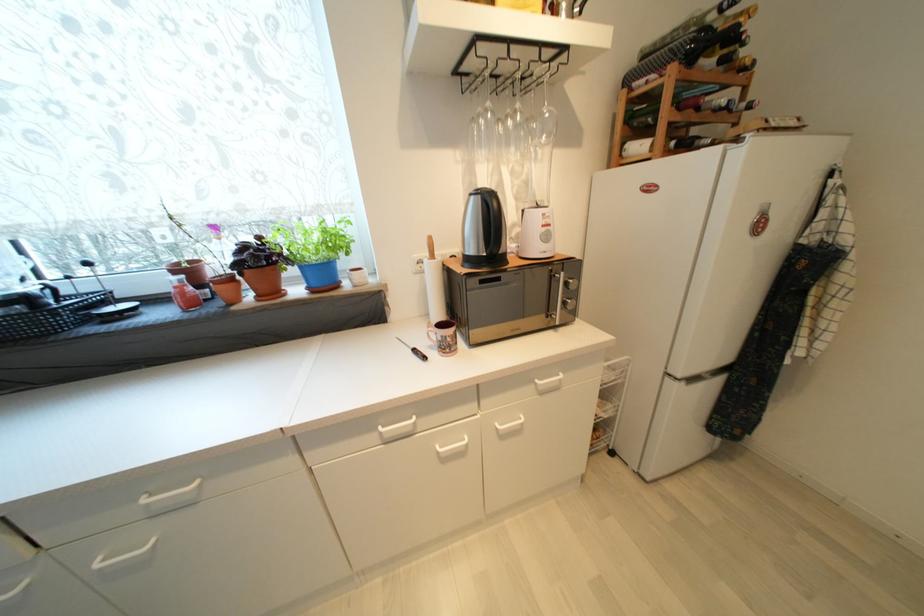
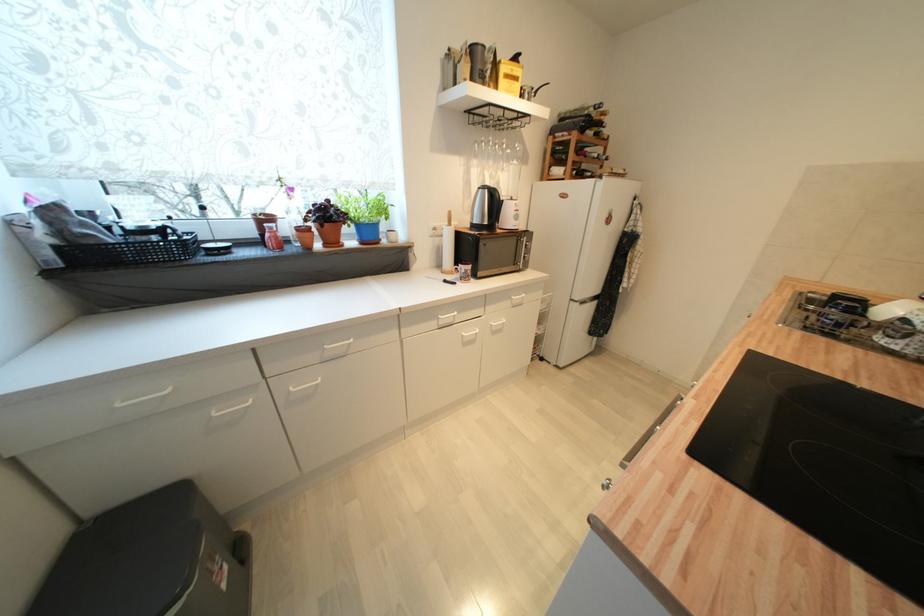
Find the pixel in the second image that matches pixel 290 272 in the first image.

(354, 228)